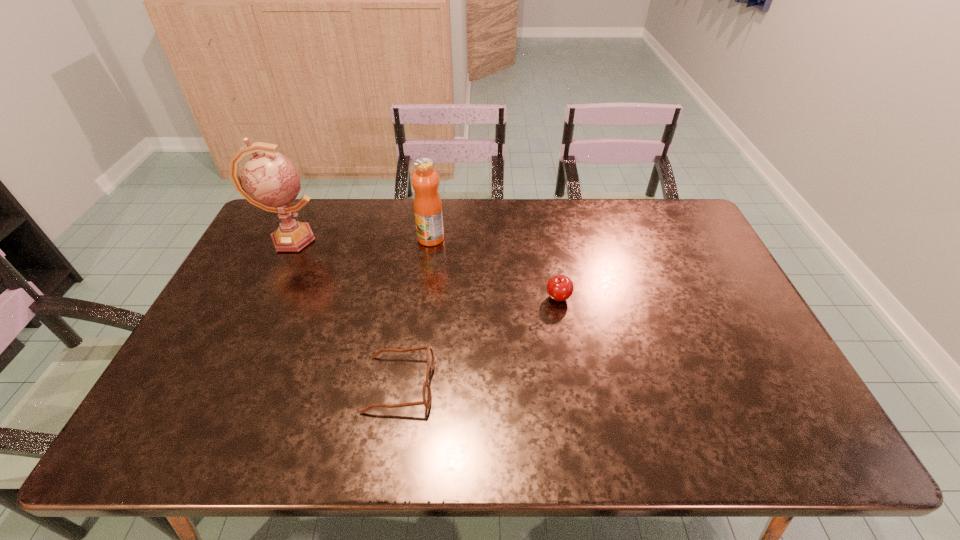
You are a GUI agent. You are given a task and a screenshot of the screen. Output one action in this format:
    pyautogui.click(x=<x>, y=<y>)
    Task: Click on the tallest object
    
    Given the screenshot: What is the action you would take?
    [269, 180]

Locate an element on the screen. This screenshot has height=540, width=960. globe is located at coordinates (269, 180).

Where is `the second tallest object`? The image size is (960, 540). the second tallest object is located at coordinates (427, 204).

Image resolution: width=960 pixels, height=540 pixels. I want to click on cherry, so click(560, 288).

Locate an element on the screen. the second shortest object is located at coordinates pos(560,288).

Locate an element on the screen. the nearest object is located at coordinates (426, 391).

Where is `the shortest object`? This screenshot has width=960, height=540. the shortest object is located at coordinates (426, 391).

Where is `vacant point located on the front-facing side of the tallest object`? The image size is (960, 540). vacant point located on the front-facing side of the tallest object is located at coordinates (408, 239).

The width and height of the screenshot is (960, 540). Find the location of `vacant space situated on the front of the fruit juice`. vacant space situated on the front of the fruit juice is located at coordinates click(x=423, y=295).

Where is `vacant position located on the left of the third farthest object`? vacant position located on the left of the third farthest object is located at coordinates (515, 298).